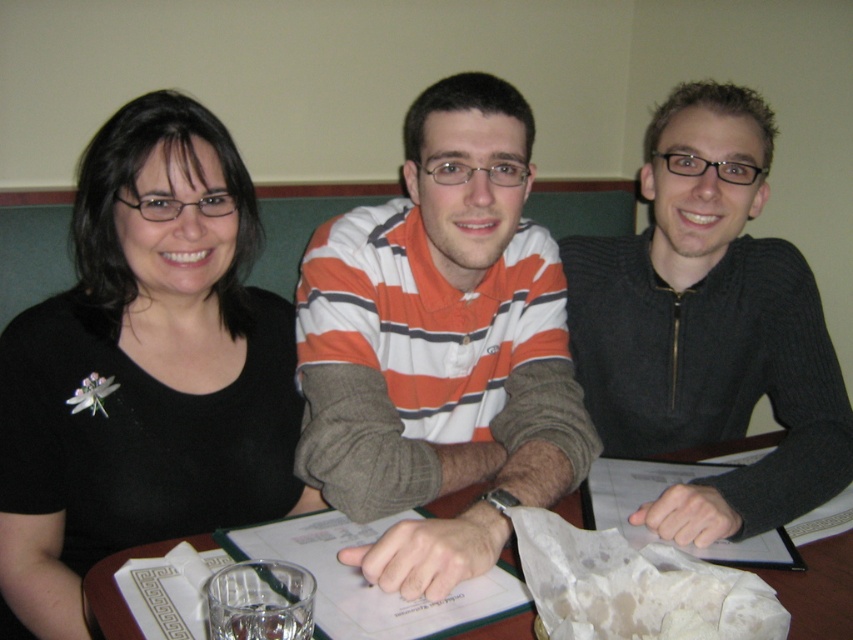
You are a photographer trying to position a spotlight on the black matte shirt at upper left. According to the coordinates provided, where should you aim the spotlight?

The black matte shirt at upper left is located at coordinates point (143, 369), so you should aim the spotlight at that exact point to ensure accurate placement.

Looking at this image, you are a photographer setting up a shoot. You need to adjust the lighting to ensure both the black matte shirt at upper left and the black ribbed sweater at center are well lit. Considering their sizes, which object requires a wider light spread to capture details effectively?

The black ribbed sweater at center requires a wider light spread because it is larger than the black matte shirt at upper left.

You are a photographer setting up for a group photo. You notice the orange striped shirt at center and the black ribbed sweater at center. Which clothing item is closer to the camera?

The orange striped shirt at center is positioned under the black ribbed sweater at center, so the black ribbed sweater at center is closer to the camera.